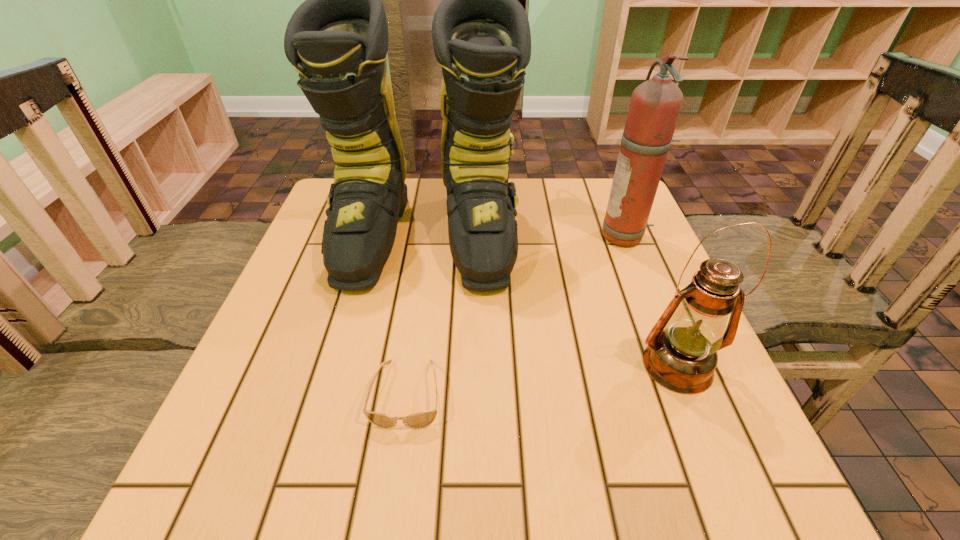
Where is `vacant area between the ski boots and the fire extinguisher`? This screenshot has height=540, width=960. vacant area between the ski boots and the fire extinguisher is located at coordinates (525, 237).

Find the location of a particular element. Image resolution: width=960 pixels, height=540 pixels. object that is the third closest to the third tallest object is located at coordinates (420, 420).

Identify which object is the third closest to the third shortest object. Please provide its 2D coordinates. Your answer should be formatted as a tuple, i.e. [(x, y)], where the tuple contains the x and y coordinates of a point satisfying the conditions above.

[(420, 420)]

Locate an element on the screen. The height and width of the screenshot is (540, 960). free space that satisfies the following two spatial constraints: 1. on the side of the fire extinguisher with the label and nozzle; 2. on the front-facing side of the shortest object is located at coordinates (690, 394).

In order to click on free space that satisfies the following two spatial constraints: 1. on the side of the fire extinguisher with the label and nozzle; 2. on the front-facing side of the sunglasses in this screenshot , I will do `click(690, 394)`.

Locate an element on the screen. The height and width of the screenshot is (540, 960). free space that satisfies the following two spatial constraints: 1. on the side of the fire extinguisher with the label and nozzle; 2. on the front-facing side of the sunglasses is located at coordinates (690, 394).